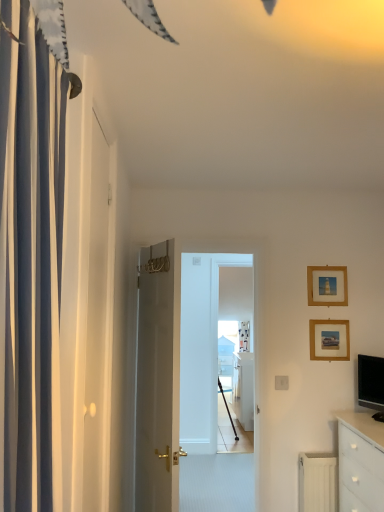
Question: From the image's perspective, does white matte door at left appear higher than white glossy cabinet at center?

Choices:
 (A) no
 (B) yes

Answer: (B)

Question: Is white matte door at left at the left side of white glossy cabinet at center?

Choices:
 (A) no
 (B) yes

Answer: (B)

Question: From a real-world perspective, is white matte door at left beneath white glossy cabinet at center?

Choices:
 (A) yes
 (B) no

Answer: (B)

Question: Does white matte door at left have a smaller size compared to white glossy cabinet at center?

Choices:
 (A) no
 (B) yes

Answer: (B)

Question: Could you tell me if white matte door at left is turned towards white glossy cabinet at center?

Choices:
 (A) yes
 (B) no

Answer: (B)

Question: Does point (165, 290) appear closer or farther from the camera than point (301, 455)?

Choices:
 (A) closer
 (B) farther

Answer: (A)

Question: Is white glossy door at center inside the boundaries of white matte radiator at lower right, or outside?

Choices:
 (A) inside
 (B) outside

Answer: (B)

Question: In terms of width, does white glossy door at center look wider or thinner when compared to white matte radiator at lower right?

Choices:
 (A) thin
 (B) wide

Answer: (B)

Question: In the image, is white glossy door at center positioned in front of or behind white matte radiator at lower right?

Choices:
 (A) behind
 (B) front

Answer: (B)

Question: Relative to white glossy chest of drawers at lower right, is white matte door at left in front or behind?

Choices:
 (A) front
 (B) behind

Answer: (A)

Question: Is point (102, 356) positioned closer to the camera than point (350, 485)?

Choices:
 (A) farther
 (B) closer

Answer: (B)

Question: In terms of height, does white matte door at left look taller or shorter compared to white glossy chest of drawers at lower right?

Choices:
 (A) short
 (B) tall

Answer: (B)

Question: Based on their positions, is white matte door at left located to the left or right of white glossy chest of drawers at lower right?

Choices:
 (A) left
 (B) right

Answer: (A)

Question: Considering their positions, is white glossy cabinet at center located in front of or behind white matte door at left?

Choices:
 (A) behind
 (B) front

Answer: (A)

Question: From the image's perspective, is white glossy cabinet at center above or below white matte door at left?

Choices:
 (A) below
 (B) above

Answer: (A)